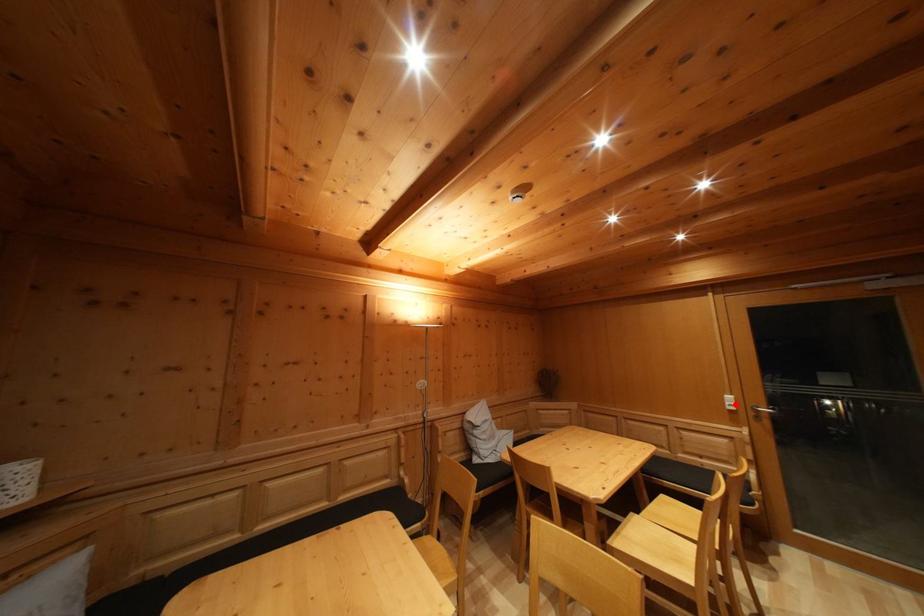
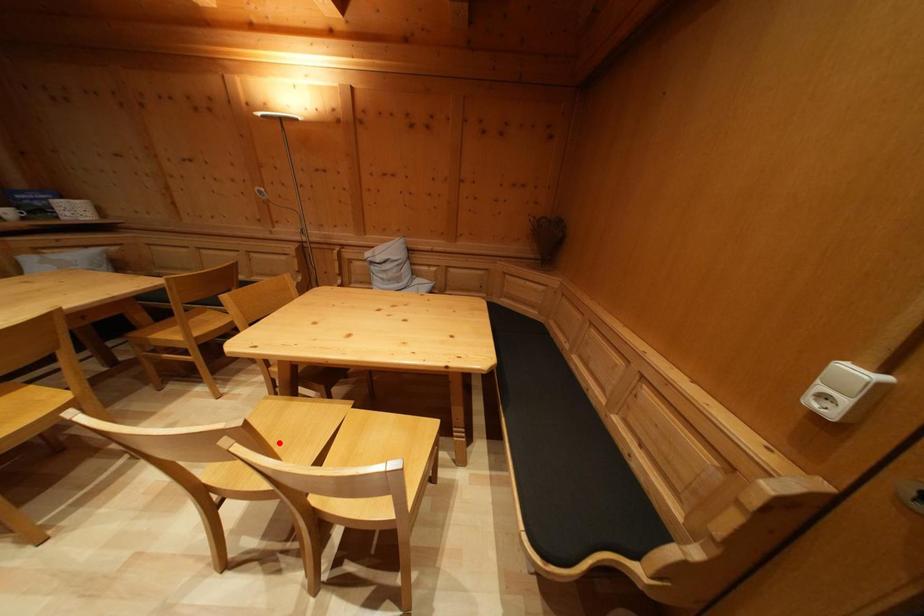
Looking at this image, I am providing you with two images of the same scene from different viewpoints. A red point is marked on the first image and another point is marked on the second image. Is the marked point in image1 the same physical position as the marked point in image2?

No